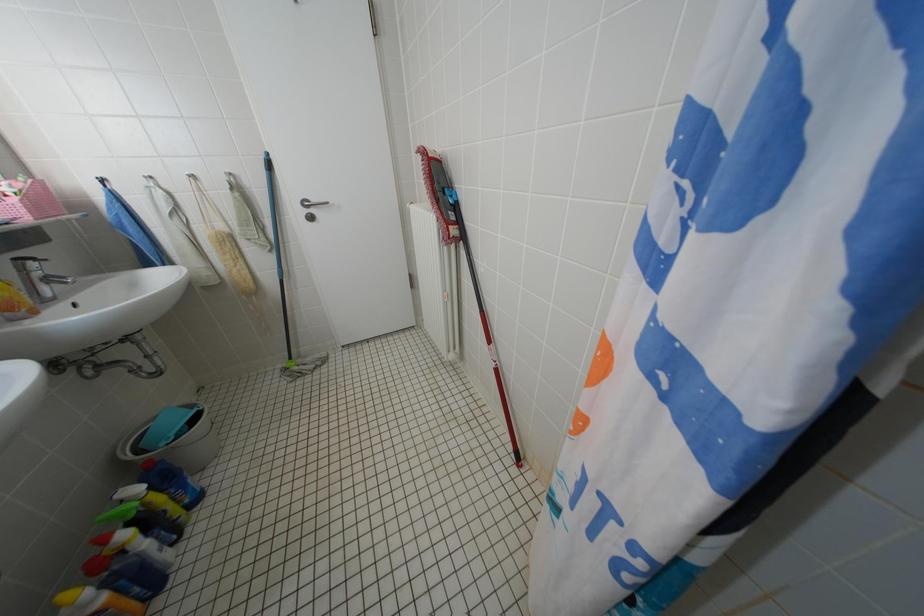
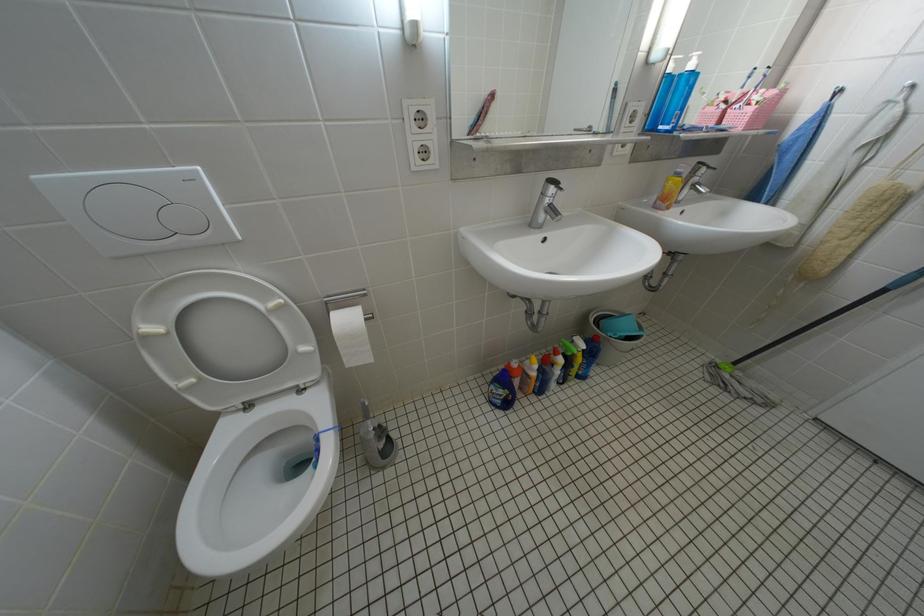
The images are taken continuously from a first-person perspective. In which direction is your viewpoint rotating?

The rotation direction of the camera is left-down.